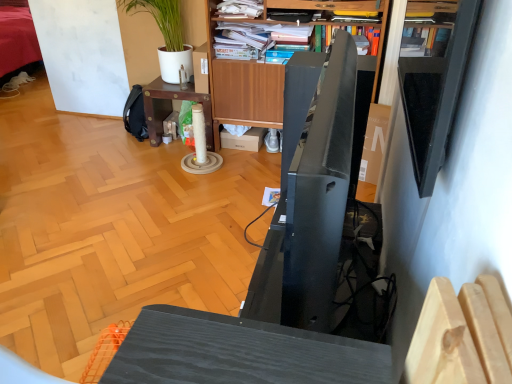
Question: Can you confirm if wooden bookshelf at upper center is positioned to the left of wooden bookcase at upper center?

Choices:
 (A) no
 (B) yes

Answer: (B)

Question: Is wooden bookshelf at upper center far from wooden bookcase at upper center?

Choices:
 (A) yes
 (B) no

Answer: (B)

Question: Is the position of wooden bookshelf at upper center more distant than that of wooden bookcase at upper center?

Choices:
 (A) no
 (B) yes

Answer: (B)

Question: Is wooden bookshelf at upper center wider than wooden bookcase at upper center?

Choices:
 (A) yes
 (B) no

Answer: (B)

Question: Is wooden bookshelf at upper center thinner than wooden bookcase at upper center?

Choices:
 (A) no
 (B) yes

Answer: (B)

Question: Could you tell me if wooden bookshelf at upper center is facing wooden bookcase at upper center?

Choices:
 (A) no
 (B) yes

Answer: (B)

Question: Is green matte plant at upper left located outside wooden desk at center?

Choices:
 (A) no
 (B) yes

Answer: (B)

Question: Considering the relative sizes of green matte plant at upper left and wooden desk at center in the image provided, is green matte plant at upper left bigger than wooden desk at center?

Choices:
 (A) no
 (B) yes

Answer: (A)

Question: Does green matte plant at upper left have a lesser height compared to wooden desk at center?

Choices:
 (A) yes
 (B) no

Answer: (B)

Question: Does green matte plant at upper left appear on the right side of wooden desk at center?

Choices:
 (A) yes
 (B) no

Answer: (B)

Question: Would you say wooden desk at center is part of green matte plant at upper left's contents?

Choices:
 (A) yes
 (B) no

Answer: (B)

Question: Considering the relative positions of green matte plant at upper left and wooden desk at center in the image provided, is green matte plant at upper left to the left of wooden desk at center from the viewer's perspective?

Choices:
 (A) yes
 (B) no

Answer: (A)

Question: From the image's perspective, is wooden bookcase at upper center beneath wooden bookshelf at upper center?

Choices:
 (A) yes
 (B) no

Answer: (A)